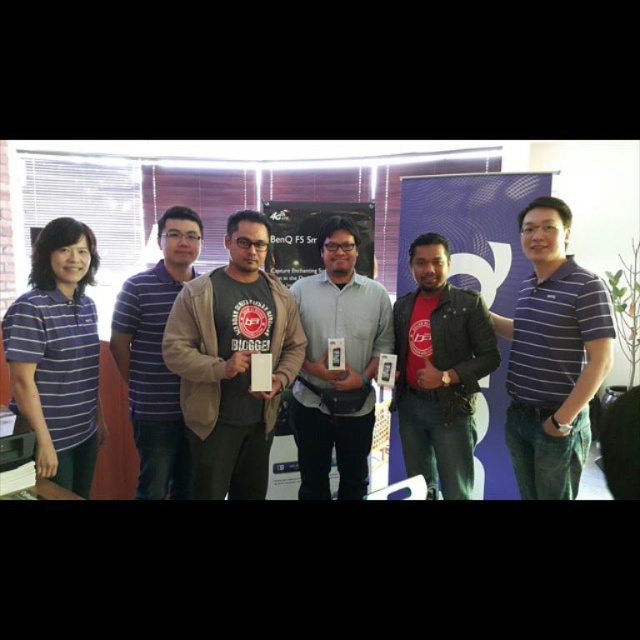
Question: Which is nearer to the red matte jacket at center?

Choices:
 (A) purple striped polo shirt at center
 (B) gray matte shirt at center
 (C) beige cotton sweater at center
 (D) blue striped shirt at left

Answer: (B)

Question: Does beige cotton sweater at center come in front of purple striped polo shirt at center?

Choices:
 (A) yes
 (B) no

Answer: (A)

Question: Among these objects, which one is nearest to the camera?

Choices:
 (A) red matte jacket at center
 (B) blue striped shirt at left
 (C) beige cotton sweater at center

Answer: (C)

Question: Which point is closer to the camera taking this photo?

Choices:
 (A) (413, 449)
 (B) (376, 362)
 (C) (129, 276)
 (D) (256, 333)

Answer: (D)

Question: Can you confirm if gray matte shirt at center is positioned above red matte jacket at center?

Choices:
 (A) no
 (B) yes

Answer: (A)

Question: Does red matte jacket at center have a smaller size compared to blue striped shirt at left?

Choices:
 (A) no
 (B) yes

Answer: (A)